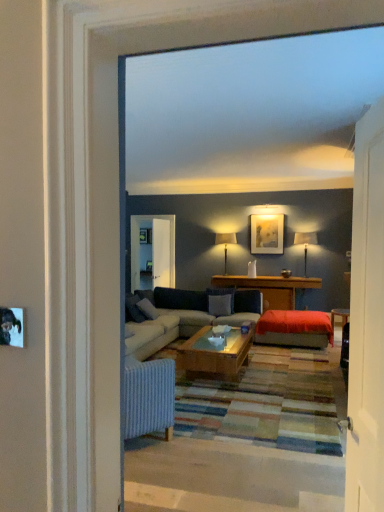
What is the approximate width of wooden table at center?

20.20 inches.

Identify the location of velvet red ottoman at center. Image resolution: width=384 pixels, height=512 pixels. (x=294, y=328).

The width and height of the screenshot is (384, 512). Identify the location of wooden table at center. (270, 288).

Is velvet red ottoman at center shorter than white wooden door at right?

Indeed, velvet red ottoman at center has a lesser height compared to white wooden door at right.

Is the position of velvet red ottoman at center more distant than that of white wooden door at right?

Yes, velvet red ottoman at center is further from the camera.

Measure the distance from velvet red ottoman at center to white wooden door at right.

velvet red ottoman at center is 3.88 meters away from white wooden door at right.

Where is `door on the left of velvet red ottoman at center`? This screenshot has width=384, height=512. door on the left of velvet red ottoman at center is located at coordinates (367, 320).

Considering the sizes of objects clear glass screen door at center and matte black lamp at upper right, positioned as the second lamp in back-to-front order, in the image provided, who is shorter, clear glass screen door at center or matte black lamp at upper right, positioned as the second lamp in back-to-front order,?

matte black lamp at upper right, positioned as the second lamp in back-to-front order, is shorter.

Considering the relative positions of clear glass screen door at center and matte black lamp at upper right, which appears as the first lamp when viewed from the front, in the image provided, is clear glass screen door at center to the left of matte black lamp at upper right, which appears as the first lamp when viewed from the front, from the viewer's perspective?

Indeed, clear glass screen door at center is positioned on the left side of matte black lamp at upper right, which appears as the first lamp when viewed from the front.

What's the angular difference between clear glass screen door at center and matte black lamp at upper right, marked as the first lamp in a right-to-left arrangement,'s facing directions?

93 degrees.

Does clear glass screen door at center have a larger size compared to matte black lamp at upper right, which is counted as the second lamp, starting from the left?

Yes.

Which object is wider, matte black lamp at upper right, positioned as the second lamp in back-to-front order, or clear glass screen door at center?

matte black lamp at upper right, positioned as the second lamp in back-to-front order.

From a real-world perspective, which is physically below, matte black lamp at upper right, positioned as the second lamp in back-to-front order, or clear glass screen door at center?

clear glass screen door at center, from a real-world perspective.

In the scene shown: From the image's perspective, who appears lower, matte black lamp at upper right, marked as the first lamp in a right-to-left arrangement, or clear glass screen door at center?

From the image's view, matte black lamp at upper right, marked as the first lamp in a right-to-left arrangement, is below.

Based on the photo, in terms of size, does matte black lamp at upper right, positioned as the second lamp in back-to-front order, appear bigger or smaller than clear glass screen door at center?

matte black lamp at upper right, positioned as the second lamp in back-to-front order, is smaller than clear glass screen door at center.

In the scene shown: Is velvet red ottoman at center far away from matte black lamp at upper right, marked as the first lamp in a right-to-left arrangement?

Yes, velvet red ottoman at center and matte black lamp at upper right, marked as the first lamp in a right-to-left arrangement, are located far from each other.

From the image's perspective, is velvet red ottoman at center on top of matte black lamp at upper right, positioned as the second lamp in back-to-front order?

Actually, velvet red ottoman at center appears below matte black lamp at upper right, positioned as the second lamp in back-to-front order, in the image.

Considering the positions of point (331, 333) and point (310, 242), is point (331, 333) closer or farther from the camera than point (310, 242)?

Point (331, 333) is positioned closer to the camera compared to point (310, 242).

Which is farther from the camera, (374, 118) or (169, 272)?

Point (169, 272)

From a real-world perspective, is white wooden door at right physically below clear glass screen door at center?

Yes, from a real-world perspective, white wooden door at right is below clear glass screen door at center.

In terms of width, does white wooden door at right look wider or thinner when compared to clear glass screen door at center?

white wooden door at right is thinner than clear glass screen door at center.

Locate an element on the screen. Image resolution: width=384 pixels, height=512 pixels. screen door on the left of white wooden door at right is located at coordinates (160, 253).

Consider the image. Considering the sizes of matte black lamp at upper right, which is counted as the second lamp, starting from the left, and white wooden door at right in the image, is matte black lamp at upper right, which is counted as the second lamp, starting from the left, bigger or smaller than white wooden door at right?

In the image, matte black lamp at upper right, which is counted as the second lamp, starting from the left, appears to be larger than white wooden door at right.

Is point (308, 244) in front of point (361, 426)?

No, (308, 244) is behind (361, 426).

Between matte black lamp at upper right, marked as the first lamp in a right-to-left arrangement, and white wooden door at right, which one is positioned in front?

white wooden door at right is closer to the camera.

From the picture: Considering the relative sizes of matte black lamp at upper right, positioned as the second lamp in back-to-front order, and white wooden door at right in the image provided, is matte black lamp at upper right, positioned as the second lamp in back-to-front order, taller than white wooden door at right?

In fact, matte black lamp at upper right, positioned as the second lamp in back-to-front order, may be shorter than white wooden door at right.

From a real-world perspective, does velvet red ottoman at center sit lower than wooden table at center?

Yes, from a real-world perspective, velvet red ottoman at center is beneath wooden table at center.

Can you confirm if velvet red ottoman at center is taller than wooden table at center?

Incorrect, the height of velvet red ottoman at center is not larger of that of wooden table at center.

Looking at their sizes, would you say velvet red ottoman at center is wider or thinner than wooden table at center?

Clearly, velvet red ottoman at center has more width compared to wooden table at center.

This screenshot has height=512, width=384. I want to click on wide on the right of white wooden door at right, so click(x=294, y=328).

I want to click on screen door behind the matte black lamp at upper right, which appears as the first lamp when viewed from the front, so click(x=160, y=253).

Which object lies nearer to the anchor point white wooden door at right, matte black lampshade at center, which ranks as the first lamp in left-to-right order, or clear glass screen door at center?

The object closer to white wooden door at right is matte black lampshade at center, which ranks as the first lamp in left-to-right order.

Which object lies nearer to the anchor point matte black lampshade at center, marked as the first lamp in a back-to-front arrangement, clear glass screen door at center or velvet red ottoman at center?

Based on the image, clear glass screen door at center appears to be nearer to matte black lampshade at center, marked as the first lamp in a back-to-front arrangement.

Estimate the real-world distances between objects in this image. Which object is closer to matte black lampshade at center, which ranks as the first lamp in left-to-right order, white wooden door at right or clear glass screen door at center?

clear glass screen door at center is closer to matte black lampshade at center, which ranks as the first lamp in left-to-right order.

Based on their spatial positions, is white wooden door at right or matte black lamp at upper right, positioned as the second lamp in back-to-front order, closer to matte gold picture frame at upper center?

Based on the image, matte black lamp at upper right, positioned as the second lamp in back-to-front order, appears to be nearer to matte gold picture frame at upper center.

Estimate the real-world distances between objects in this image. Which object is further from matte black lamp at upper right, which is counted as the second lamp, starting from the left, matte gold picture frame at upper center or clear glass screen door at center?

The object further to matte black lamp at upper right, which is counted as the second lamp, starting from the left, is clear glass screen door at center.

Considering their positions, is clear glass screen door at center positioned closer to matte black lampshade at center, which is the 2th lamp in right-to-left order, than matte black lamp at upper right, which appears as the first lamp when viewed from the front?

clear glass screen door at center lies closer to matte black lampshade at center, which is the 2th lamp in right-to-left order, than the other object.

Considering their positions, is clear glass screen door at center positioned further to white wooden door at right than wooden table at center?

Based on the image, clear glass screen door at center appears to be further to white wooden door at right.

Based on their spatial positions, is wooden table at center or matte black lampshade at center, which ranks as the first lamp in left-to-right order, further from matte gold picture frame at upper center?

Among the two, wooden table at center is located further to matte gold picture frame at upper center.

Where is `lamp situated between clear glass screen door at center and wooden table at center from left to right`? The height and width of the screenshot is (512, 384). lamp situated between clear glass screen door at center and wooden table at center from left to right is located at coordinates (225, 243).

Identify the location of table located between matte black lampshade at center, which ranks as the first lamp in left-to-right order, and matte black lamp at upper right, which is counted as the second lamp, starting from the left, in the left-right direction. (270, 288).

Locate an element on the screen. The image size is (384, 512). lamp between clear glass screen door at center and matte gold picture frame at upper center from left to right is located at coordinates (225, 243).

Identify the location of table between velvet red ottoman at center and clear glass screen door at center in the front-back direction. (270, 288).